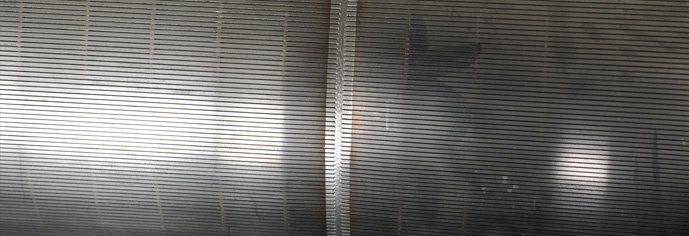
The image size is (689, 236). In order to click on horizonal venetian blinds beam in this screenshot , I will do `click(123, 29)`.